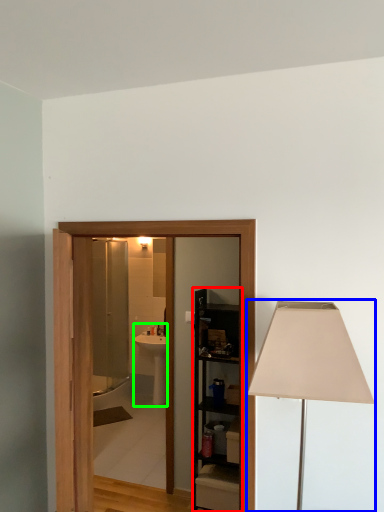
Question: Which is nearer to the cabinetry (highlighted by a red box)? lamp (highlighted by a blue box) or sink (highlighted by a green box).

Choices:
 (A) lamp
 (B) sink

Answer: (B)